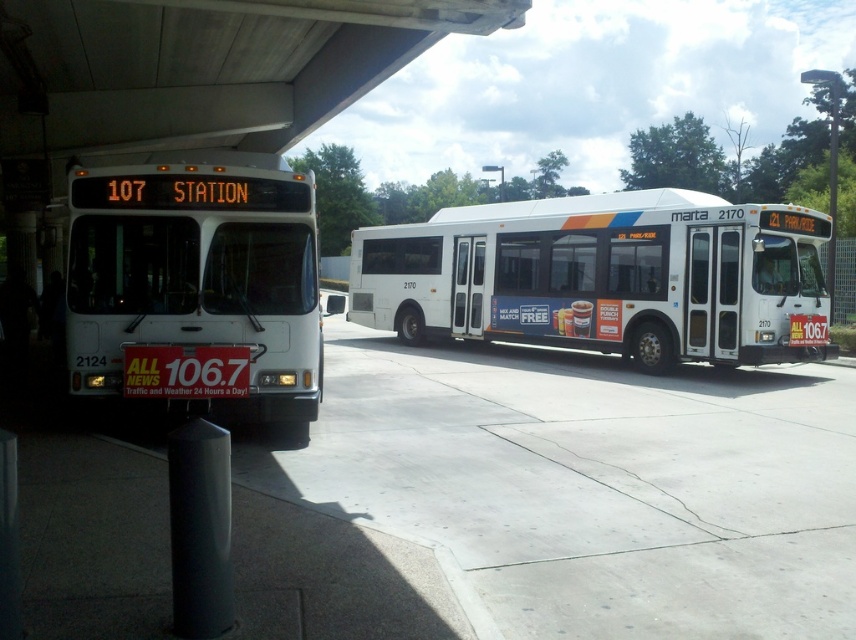
Question: Does white matte bus at center have a greater width compared to white matte bus at left?

Choices:
 (A) no
 (B) yes

Answer: (B)

Question: Is white matte bus at center below white matte bus at left?

Choices:
 (A) no
 (B) yes

Answer: (A)

Question: In this image, where is white matte bus at center located relative to white matte bus at left?

Choices:
 (A) below
 (B) above

Answer: (B)